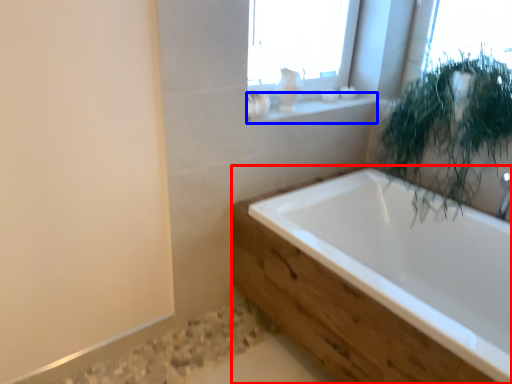
Question: Among these objects, which one is farthest to the camera, bathtub (highlighted by a red box) or window sill (highlighted by a blue box)?

Choices:
 (A) bathtub
 (B) window sill

Answer: (B)